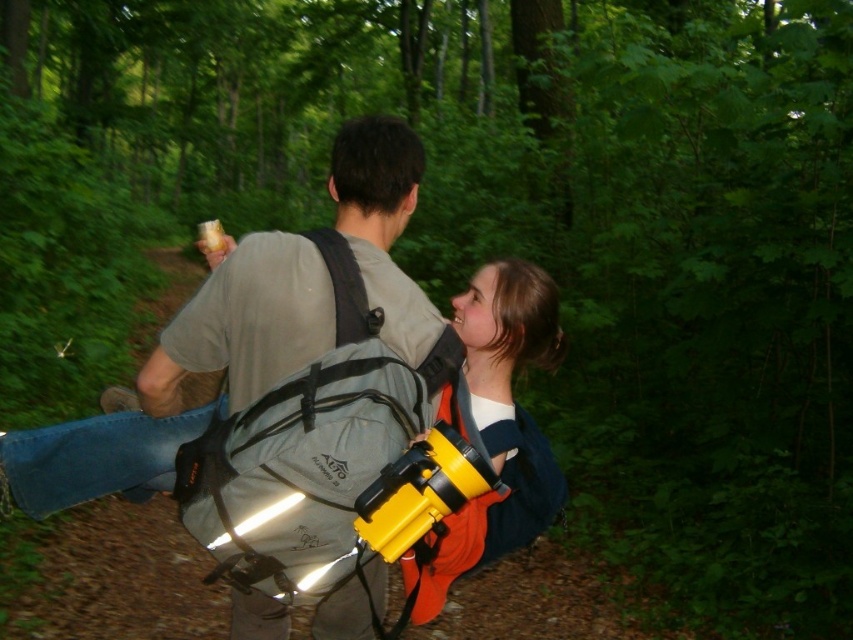
You are a hiker trying to determine the best path through the forest. You notice two points marked on the trail map at coordinates point (263, 500) and point (369, 321). Which point is closer to your current position?

Point (263, 500) is closer to the viewer than point (369, 321), so the point at (263, 500) is closer to your current position.

You are a photographer planning to take a photo of the two hikers in the forest. You have two cameras available, the yellow matte camera at center and the yellow plastic camera at center. Which camera should you choose if you need a larger one for better stability?

The yellow matte camera at center is larger in size compared to the yellow plastic camera at center, so you should choose the yellow matte camera at center for better stability.

You are a photographer trying to decide whether to carry the yellow matte camera at center or the black fabric strap at upper center. Which item is taller?

The yellow matte camera at center is taller than the black fabric strap at upper center.